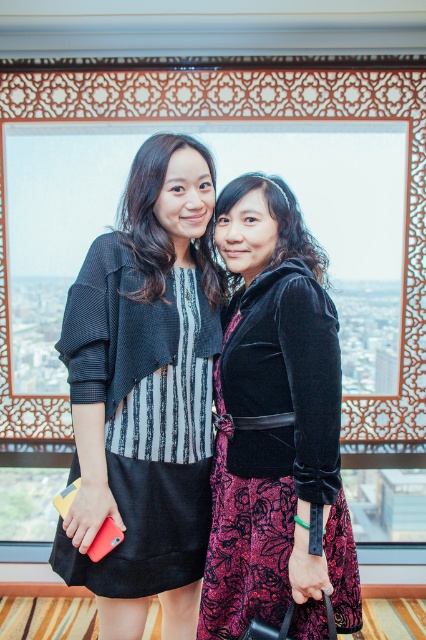
Question: Among these points, which one is nearest to the camera?

Choices:
 (A) (138, 477)
 (B) (331, 428)

Answer: (B)

Question: Is velvet/black dress at center positioned at the back of black velvet dress at center?

Choices:
 (A) yes
 (B) no

Answer: (B)

Question: Which of the following is the closest to the observer?

Choices:
 (A) (94, 387)
 (B) (238, 540)

Answer: (A)

Question: Is velvet/black dress at center positioned at the back of black velvet dress at center?

Choices:
 (A) no
 (B) yes

Answer: (A)

Question: Is the position of velvet/black dress at center more distant than that of black velvet dress at center?

Choices:
 (A) yes
 (B) no

Answer: (B)

Question: Among these points, which one is farthest from the camera?

Choices:
 (A) (118, 579)
 (B) (288, 488)

Answer: (A)